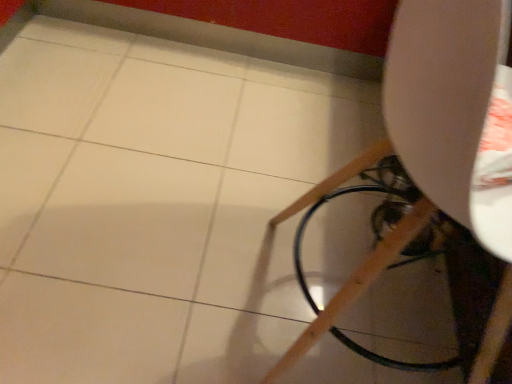
Locate an element on the screen. The width and height of the screenshot is (512, 384). free space to the left of matte white chair at right is located at coordinates (183, 271).